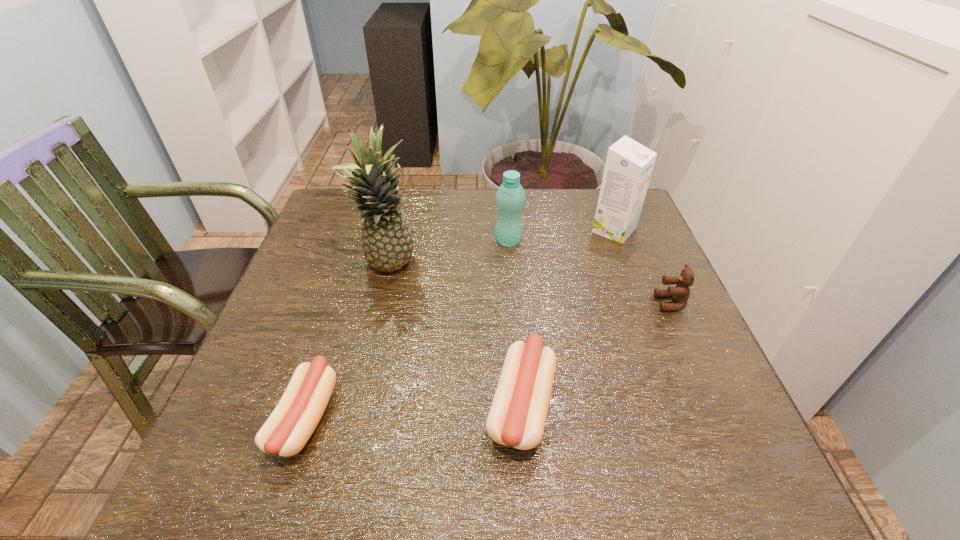
This screenshot has height=540, width=960. I want to click on free space that is in between the second shortest object and the pineapple, so click(455, 335).

Locate an element on the screen. Image resolution: width=960 pixels, height=540 pixels. vacant space that is in between the fourth tallest object and the pineapple is located at coordinates (529, 285).

Identify which object is the third nearest to the third tallest object. Please provide its 2D coordinates. Your answer should be formatted as a tuple, i.e. [(x, y)], where the tuple contains the x and y coordinates of a point satisfying the conditions above.

[(680, 294)]

Locate an element on the screen. The image size is (960, 540). object that is the closest to the shortest object is located at coordinates (387, 244).

Image resolution: width=960 pixels, height=540 pixels. I want to click on blank area in the image that satisfies the following two spatial constraints: 1. on the back side of the bottle; 2. on the right side of the shortest object, so click(x=362, y=241).